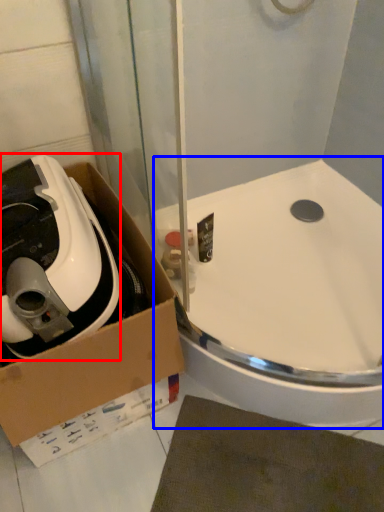
Question: Which object is further to the camera taking this photo, appliance (highlighted by a red box) or sink (highlighted by a blue box)?

Choices:
 (A) appliance
 (B) sink

Answer: (B)